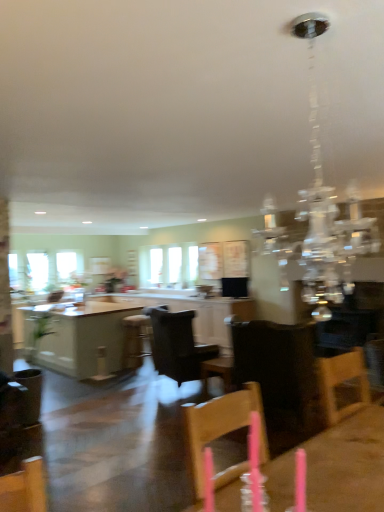
Find the location of a particular element. This screenshot has height=512, width=384. empty space that is ontop of clear crystal chandelier at upper center (from a real-world perspective) is located at coordinates (301, 28).